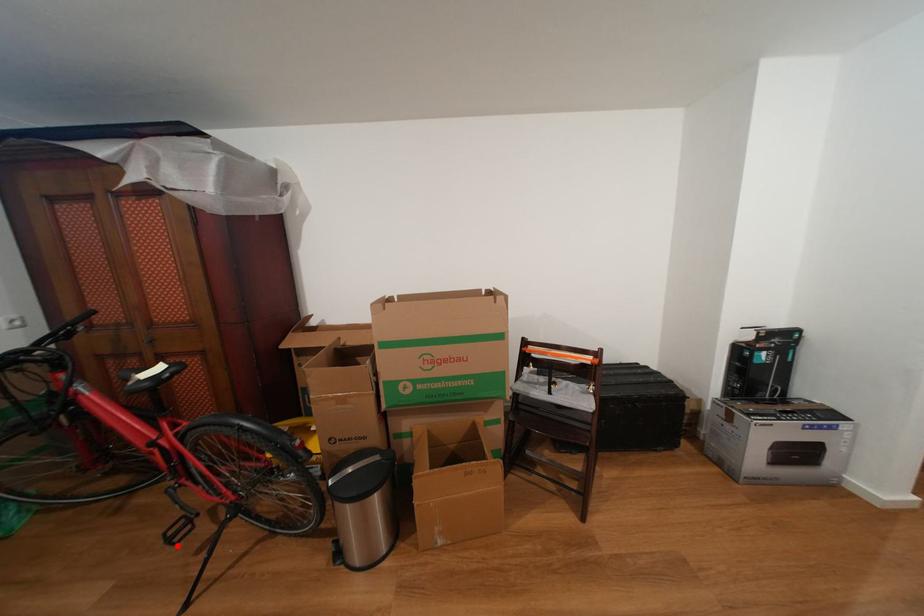
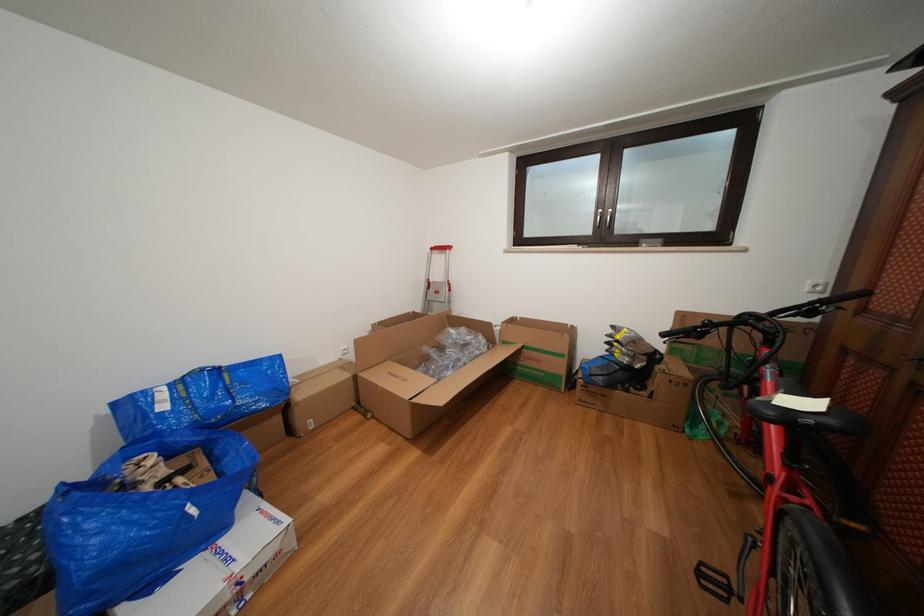
Where in the second image is the point corresponding to the highlighted location from the first image?

(708, 578)